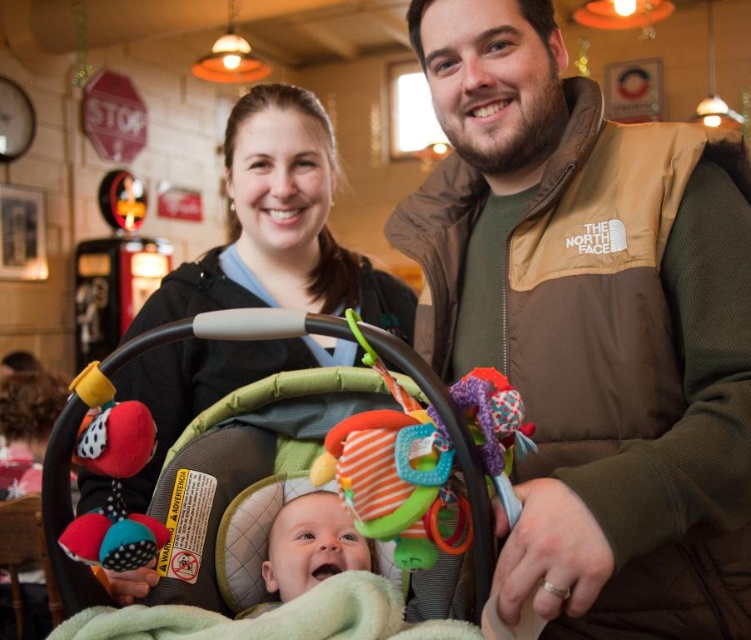
Question: Is green fabric baby carriage at center positioned in front of matte black jacket at center?

Choices:
 (A) yes
 (B) no

Answer: (A)

Question: Observing the image, what is the correct spatial positioning of green fabric baby carriage at center in reference to matte black jacket at center?

Choices:
 (A) left
 (B) right

Answer: (B)

Question: Is brown fleece vest at center above matte black jacket at center?

Choices:
 (A) no
 (B) yes

Answer: (B)

Question: Estimate the real-world distances between objects in this image. Which object is closer to the green fabric baby carriage at center?

Choices:
 (A) matte black jacket at center
 (B) brown fleece vest at center
 (C) soft green blanket at center

Answer: (C)

Question: Which object is positioned closest to the soft green blanket at center?

Choices:
 (A) matte black jacket at center
 (B) green fabric baby carriage at center

Answer: (B)

Question: Among these points, which one is nearest to the camera?

Choices:
 (A) (290, 502)
 (B) (519, 596)

Answer: (B)